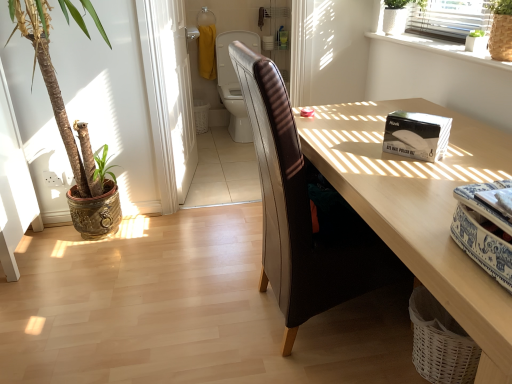
At what (x,y) coordinates should I click in order to perform the action: click on free spot to the right of white glossy nail polish kit at upper right. Please return your answer as a coordinate pair (x, y). This screenshot has width=512, height=384. Looking at the image, I should click on (473, 148).